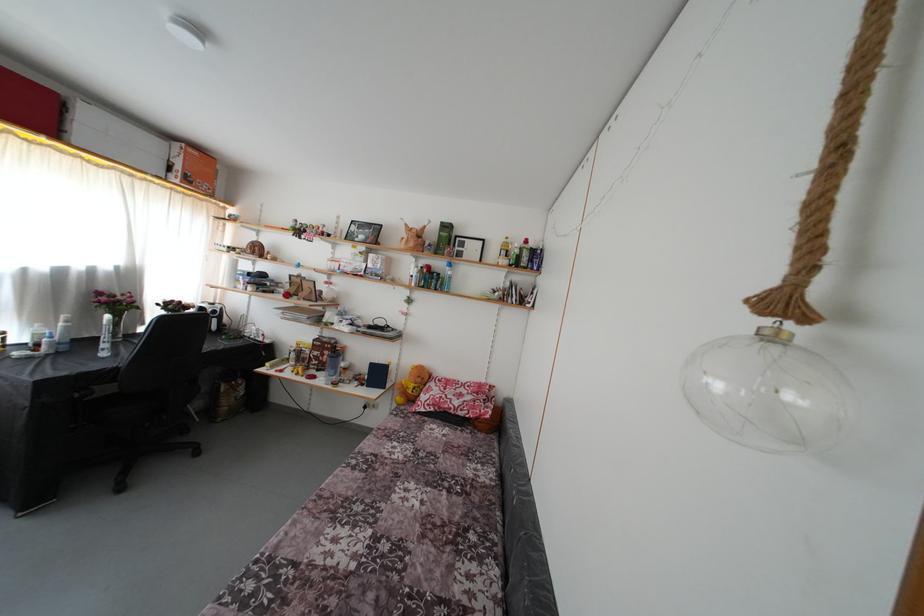
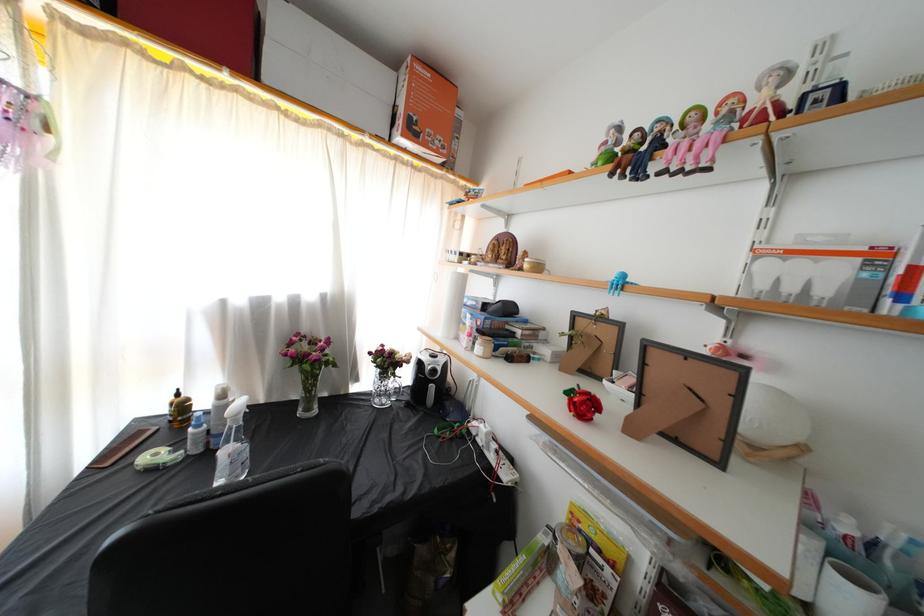
The point at (192, 185) is marked in the first image. Where is the corresponding point in the second image?

(418, 137)